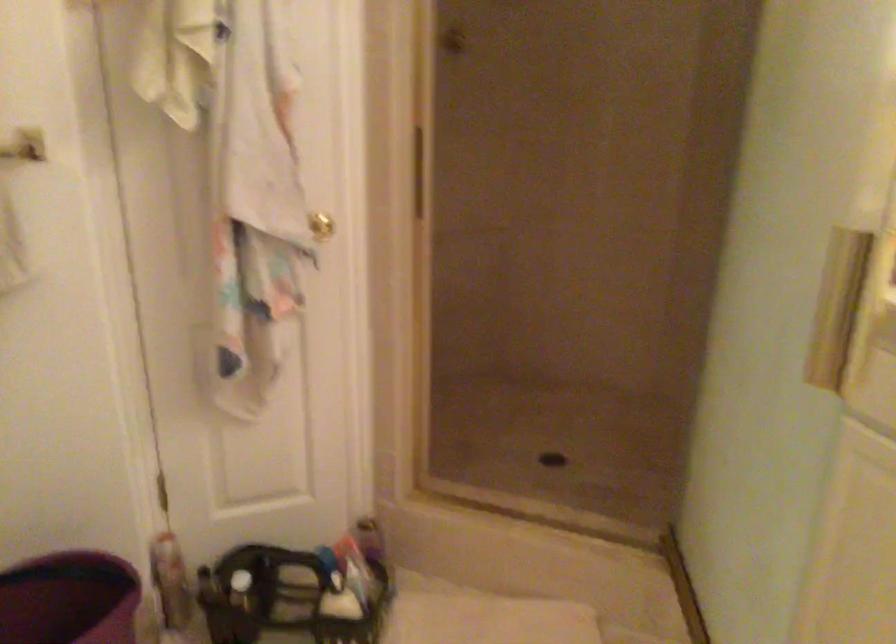
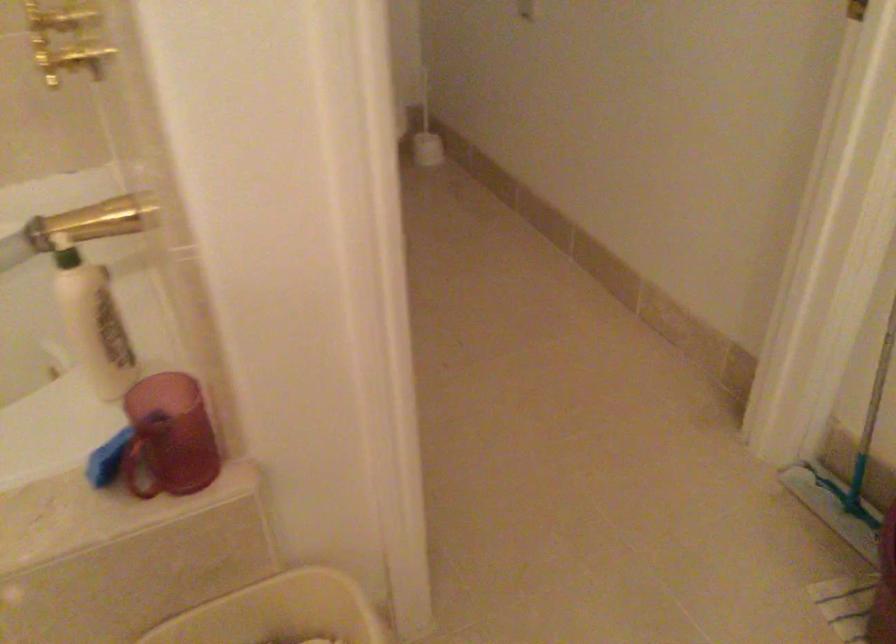
First-person continuous shooting, in which direction is the camera rotating?

The camera rotated toward left-down.